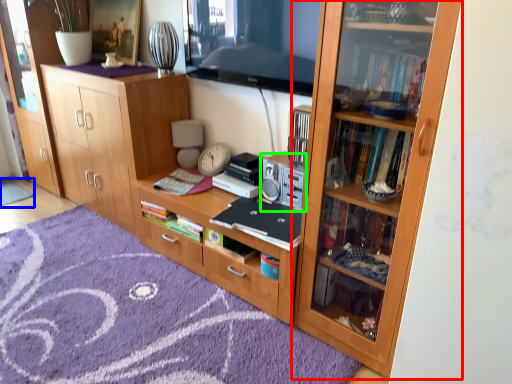
Question: Based on their relative distances, which object is farther from bookcase (highlighted by a red box)? Choose from doormat (highlighted by a blue box) and stereo (highlighted by a green box).

Choices:
 (A) doormat
 (B) stereo

Answer: (A)